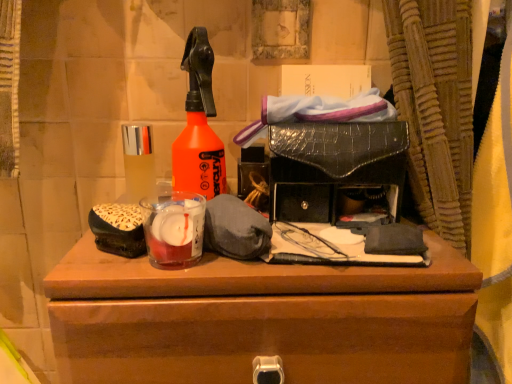
This screenshot has height=384, width=512. Identify the location of translucent glass bottle at center left. (138, 161).

You are a GUI agent. You are given a task and a screenshot of the screen. Output one action in this format:
    pyautogui.click(x=<x>, y=<y>)
    Task: Click on the brown wooden chest of drawers at center
    This screenshot has height=384, width=512.
    Given the screenshot: What is the action you would take?
    pyautogui.click(x=261, y=319)

Is brown wooden chest of drawers at center next to translucent glass bottle at center left and touching it?

No, brown wooden chest of drawers at center is not with translucent glass bottle at center left.

Which is less distant, (445, 270) or (138, 151)?

Point (445, 270) appears to be closer to the viewer than point (138, 151).

From a real-world perspective, who is located lower, brown wooden chest of drawers at center or translucent glass bottle at center left?

From a 3D spatial view, brown wooden chest of drawers at center is below.

Can you confirm if translucent glass candle at center is positioned to the left of brown wooden chest of drawers at center?

Yes.

Who is more distant, translucent glass candle at center or brown wooden chest of drawers at center?

translucent glass candle at center is behind.

Is translucent glass candle at center positioned far away from brown wooden chest of drawers at center?

No, there isn't a large distance between translucent glass candle at center and brown wooden chest of drawers at center.

From the image's perspective, does translucent glass candle at center appear higher than brown wooden chest of drawers at center?

Yes, from the image's perspective, translucent glass candle at center is above brown wooden chest of drawers at center.

Is translucent glass candle at center positioned with its back to translucent glass bottle at center left?

Yes, translucent glass candle at center is positioned with its back facing translucent glass bottle at center left.

From a real-world perspective, is translucent glass candle at center positioned above or below translucent glass bottle at center left?

In terms of real-world spatial position, translucent glass candle at center is below translucent glass bottle at center left.

Considering the sizes of objects translucent glass candle at center and translucent glass bottle at center left in the image provided, who is shorter, translucent glass candle at center or translucent glass bottle at center left?

translucent glass candle at center.

Is translucent glass candle at center at the right side of translucent glass bottle at center left?

Indeed, translucent glass candle at center is positioned on the right side of translucent glass bottle at center left.

Identify the location of beverage below the translucent glass bottle at center left (from the image's perspective). (174, 229).

Is translucent glass bottle at center left not near translucent glass candle at center?

Actually, translucent glass bottle at center left and translucent glass candle at center are a little close together.

Between translucent glass bottle at center left and translucent glass candle at center, which one is positioned in front?

translucent glass candle at center is closer to the camera.

From the image's perspective, would you say brown wooden chest of drawers at center is shown under translucent glass candle at center?

Correct, brown wooden chest of drawers at center appears lower than translucent glass candle at center in the image.

Is brown wooden chest of drawers at center bigger or smaller than translucent glass candle at center?

Clearly, brown wooden chest of drawers at center is larger in size than translucent glass candle at center.

Is brown wooden chest of drawers at center in front of or behind translucent glass candle at center in the image?

brown wooden chest of drawers at center is in front of translucent glass candle at center.

Are brown wooden chest of drawers at center and translucent glass candle at center making contact?

They are not placed beside each other.

Considering the points (133, 201) and (220, 317), which point is in front, point (133, 201) or point (220, 317)?

The point (220, 317) is closer to the camera.

Which is in front, translucent glass bottle at center left or brown wooden chest of drawers at center?

brown wooden chest of drawers at center is more forward.

From the image's perspective, which object appears higher, translucent glass bottle at center left or brown wooden chest of drawers at center?

translucent glass bottle at center left.

Is translucent glass bottle at center left outside of brown wooden chest of drawers at center?

translucent glass bottle at center left is positioned outside brown wooden chest of drawers at center.

You are a GUI agent. You are given a task and a screenshot of the screen. Output one action in this format:
    pyautogui.click(x=<x>, y=<y>)
    Task: Click on the toiletry located above the brown wooden chest of drawers at center (from a real-world perspective)
    This screenshot has width=512, height=384.
    Given the screenshot: What is the action you would take?
    pyautogui.click(x=138, y=161)

Locate an element on the screen. beverage above the brown wooden chest of drawers at center (from the image's perspective) is located at coordinates (174, 229).

Estimate the real-world distances between objects in this image. Which object is closer to translucent glass candle at center, brown wooden chest of drawers at center or translucent glass bottle at center left?

Based on the image, translucent glass bottle at center left appears to be nearer to translucent glass candle at center.

When comparing their distances from translucent glass candle at center, does translucent glass bottle at center left or brown wooden chest of drawers at center seem further?

brown wooden chest of drawers at center.

When comparing their distances from brown wooden chest of drawers at center, does translucent glass bottle at center left or translucent glass candle at center seem further?

Based on the image, translucent glass bottle at center left appears to be further to brown wooden chest of drawers at center.

From the picture: When comparing their distances from translucent glass bottle at center left, does brown wooden chest of drawers at center or translucent glass candle at center seem closer?

translucent glass candle at center lies closer to translucent glass bottle at center left than the other object.

Estimate the real-world distances between objects in this image. Which object is further from brown wooden chest of drawers at center, translucent glass candle at center or translucent glass bottle at center left?

translucent glass bottle at center left is further to brown wooden chest of drawers at center.

When comparing their distances from translucent glass bottle at center left, does translucent glass candle at center or brown wooden chest of drawers at center seem further?

The object further to translucent glass bottle at center left is brown wooden chest of drawers at center.

The width and height of the screenshot is (512, 384). I want to click on beverage between translucent glass bottle at center left and brown wooden chest of drawers at center in the vertical direction, so click(x=174, y=229).